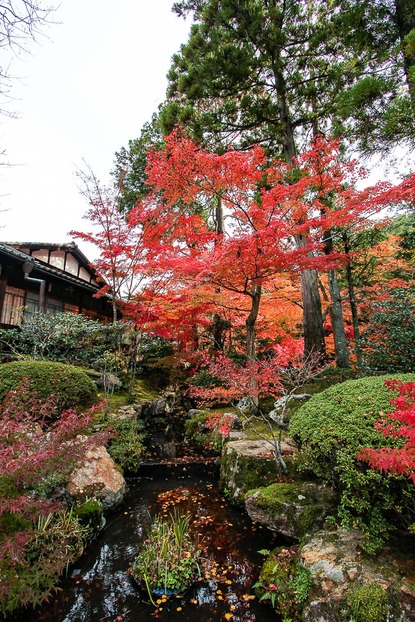
The width and height of the screenshot is (415, 622). I want to click on plant with red leaves on the right, so click(x=405, y=453).